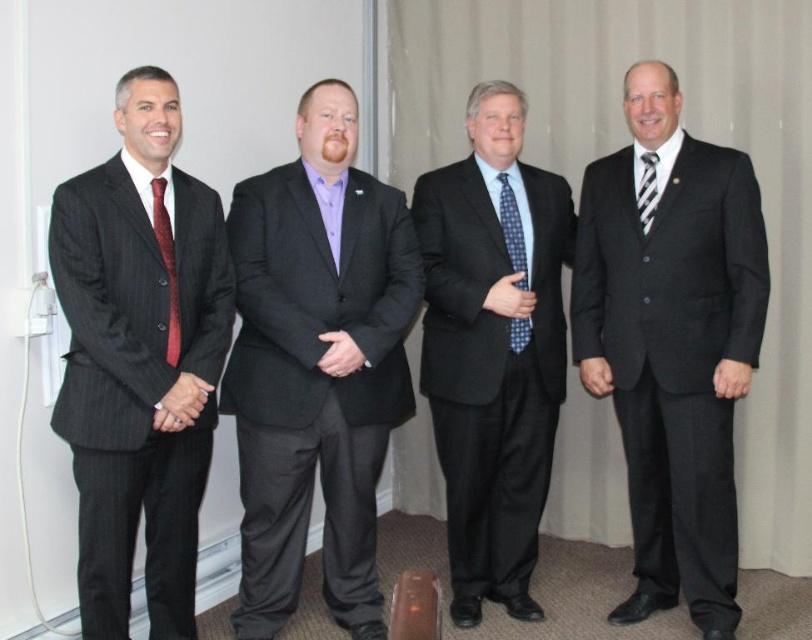
In the scene shown: You are a photographer setting up for a group photo. You need to adjust the camera focus to ensure both the matte black suit at right and the blue dotted tie at center are in sharp focus. Given their positions, which object should you focus on first to maximize clarity for both?

You should focus on the matte black suit at right first because it is closer to the viewer than the blue dotted tie at center. By focusing on the closer object, the depth of field may better include both in focus.

You are a photographer arranging a group photo. You need to ensure that the matte black suit at right and the pinstripe suit at left are arranged according to their positions in the scene. Which suit should be placed to the right of the other?

The matte black suit at right should be placed to the right of the pinstripe suit at left because the matte black suit at right is positioned on the right side of the pinstripe suit at left in the scene.

You are a photographer setting up a shoot in the scene described. You need to position a backdrop that must be taller than both the matte black suit at right and the pinstripe suit at left. Based on their heights, what is the minimum height the backdrop should be?

The matte black suit at right is taller than the pinstripe suit at left. Therefore, the backdrop must be at least as tall as the matte black suit at right to accommodate both.